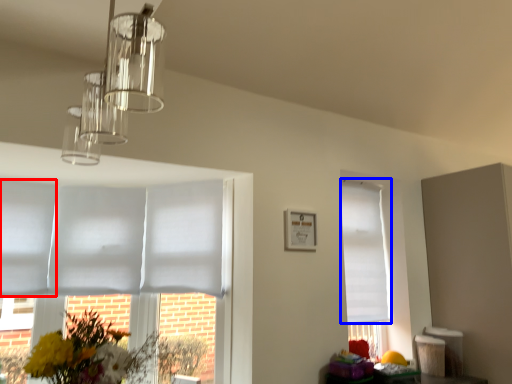
Question: Among these objects, which one is farthest to the camera, blind (highlighted by a red box) or blind (highlighted by a blue box)?

Choices:
 (A) blind
 (B) blind

Answer: (B)